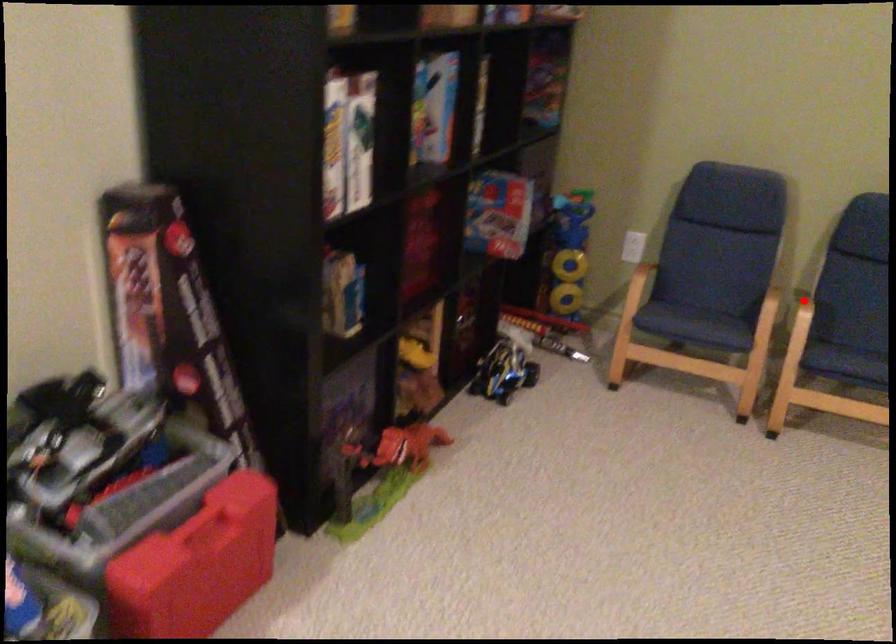
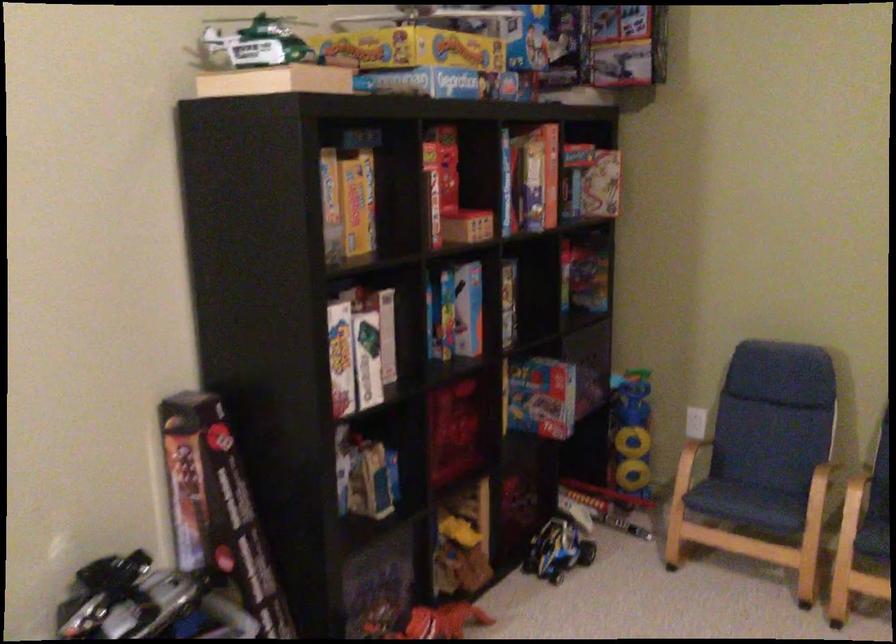
Locate, in the second image, the point that corresponds to the highlighted location in the first image.

(858, 480)